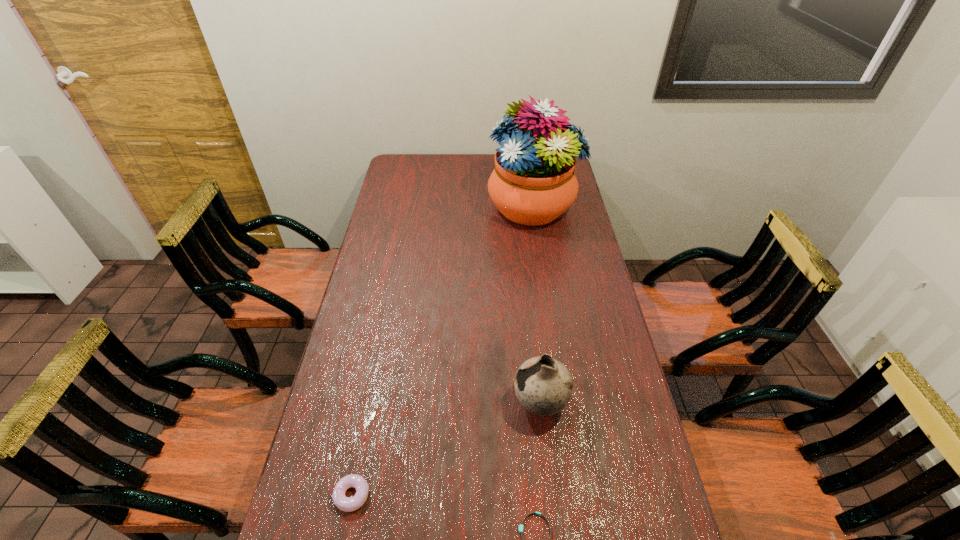
Image resolution: width=960 pixels, height=540 pixels. In order to click on the tallest object in this screenshot , I will do `click(533, 183)`.

You are a GUI agent. You are given a task and a screenshot of the screen. Output one action in this format:
    pyautogui.click(x=<x>, y=<y>)
    Task: Click on the flower arrangement
    The width and height of the screenshot is (960, 540).
    Given the screenshot: What is the action you would take?
    pyautogui.click(x=533, y=183)

This screenshot has height=540, width=960. I want to click on the third shortest object, so click(x=543, y=385).

This screenshot has height=540, width=960. In order to click on the second farthest object in this screenshot , I will do `click(543, 385)`.

Where is `doughnut`? This screenshot has width=960, height=540. doughnut is located at coordinates (347, 504).

Locate an element on the screen. the third tallest object is located at coordinates (347, 504).

This screenshot has width=960, height=540. I want to click on free space located 0.210m on the back of the tallest object, so click(526, 159).

This screenshot has width=960, height=540. Find the location of `vacant space located 0.100m from the spout of the second tallest object`. vacant space located 0.100m from the spout of the second tallest object is located at coordinates (477, 403).

This screenshot has height=540, width=960. I want to click on vacant space located from the spout of the second tallest object, so click(x=372, y=403).

Find the location of a particular element. Image resolution: width=960 pixels, height=540 pixels. free space located 0.390m from the spout of the second tallest object is located at coordinates (375, 403).